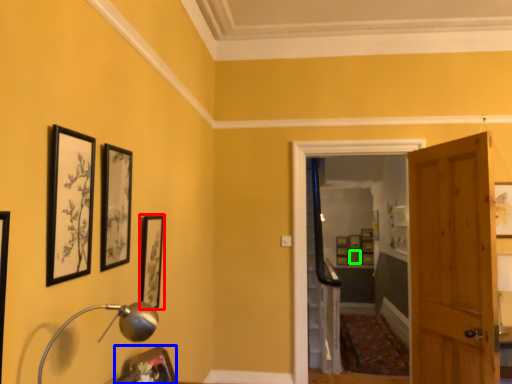
Question: Which object is the closest to the picture frame (highlighted by a red box)? Choose among these: picture frame (highlighted by a blue box) or picture frame (highlighted by a green box).

Choices:
 (A) picture frame
 (B) picture frame

Answer: (A)